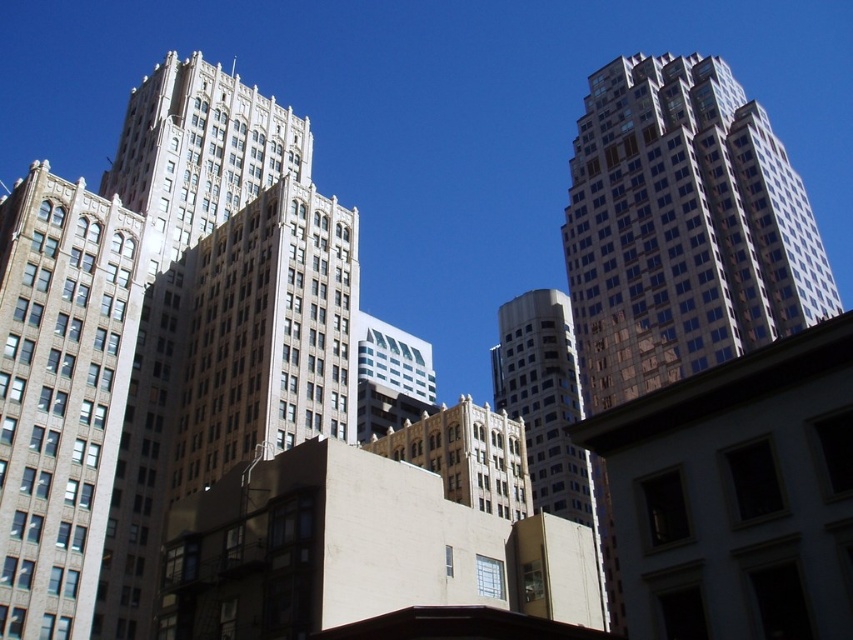
Question: Which of the following is the farthest from the observer?

Choices:
 (A) reflective glass skyscraper at right
 (B) brown brick building at left

Answer: (B)

Question: Among these objects, which one is nearest to the camera?

Choices:
 (A) reflective glass skyscraper at right
 (B) brown brick building at left

Answer: (A)

Question: Does reflective glass skyscraper at right appear on the right side of brown brick building at left?

Choices:
 (A) no
 (B) yes

Answer: (B)

Question: Can you confirm if reflective glass skyscraper at right is positioned to the right of brown brick building at left?

Choices:
 (A) yes
 (B) no

Answer: (A)

Question: Which point is farther from the camera taking this photo?

Choices:
 (A) (601, 125)
 (B) (22, 548)

Answer: (A)

Question: Does reflective glass skyscraper at right appear over brown brick building at left?

Choices:
 (A) yes
 (B) no

Answer: (A)